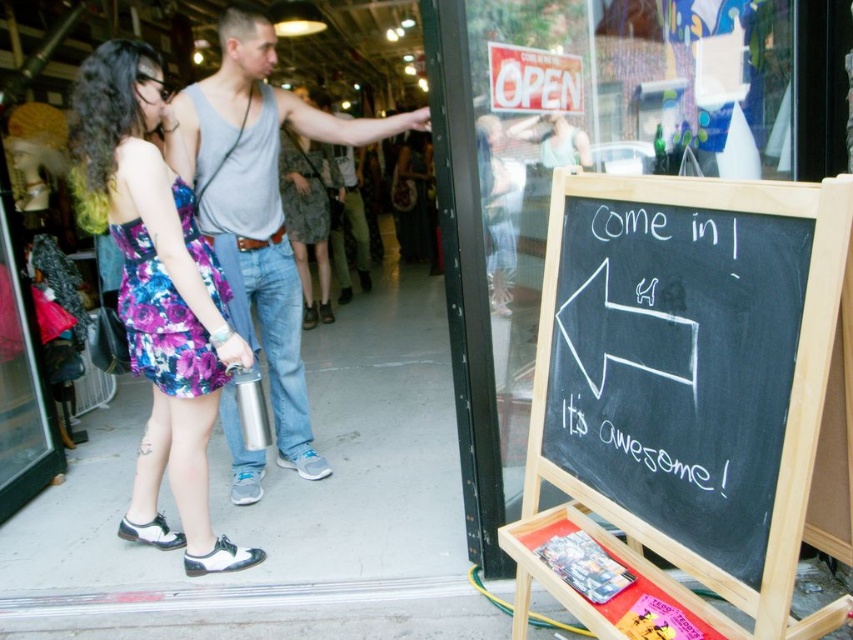
You are a customer approaching the storefront and notice the black chalkboard at lower right and the floral fabric dress at center. Which object is closer to you as you walk towards the storefront?

The black chalkboard at lower right is closer to you because it is in front of the floral fabric dress at center.

You are standing in front of the storefront and want to find the black chalkboard at lower right. Based on the coordinates provided in the Objects Description, can you determine its position relative to the center of the image?

The black chalkboard at lower right is located at coordinates point (683,392), which places it to the right and slightly below the center of the image since the x coordinate is greater than 0.5 and the y coordinate is also greater than 0.5 but closer to the bottom half.